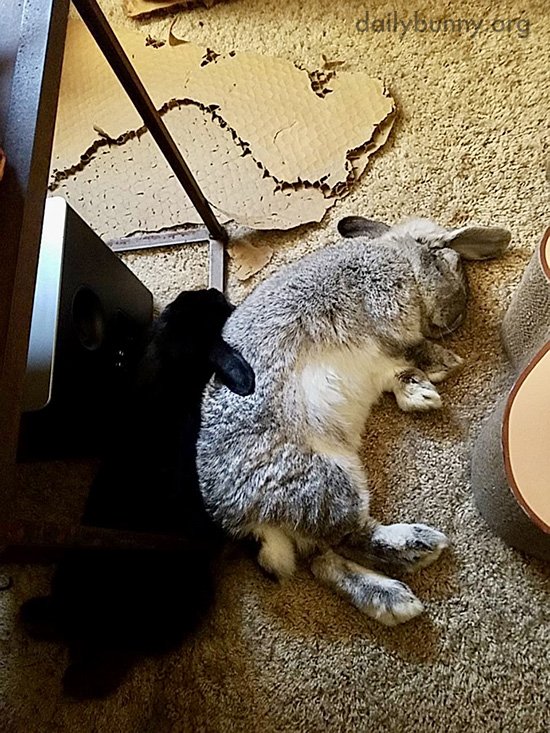
Where is `carpet`? carpet is located at coordinates pyautogui.click(x=476, y=681).